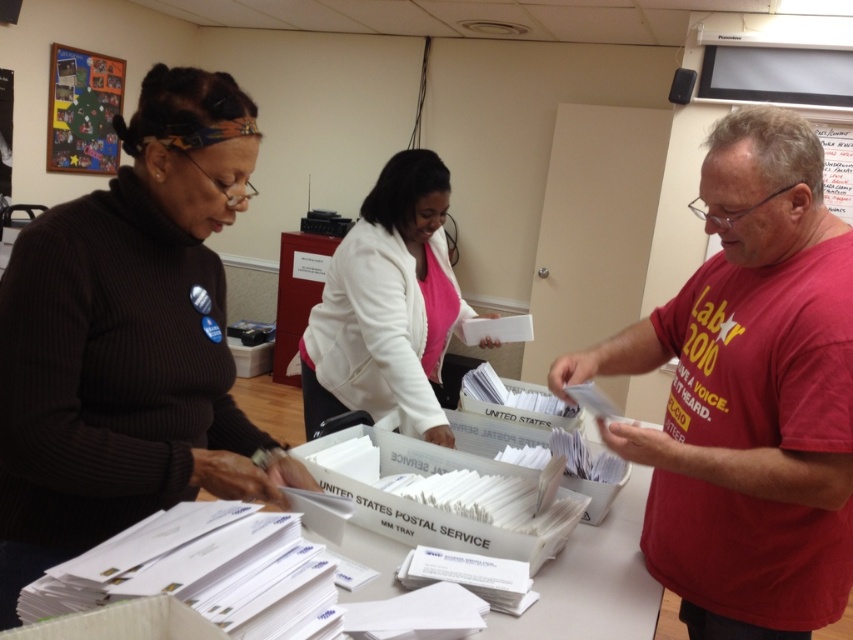
Consider the image. You are a postal worker who needs to place a new envelope into the correct tray. You notice the white matte jacket at center and the white paper at center. Which object is closer to you as you stand at the entrance of the postal service location?

The white paper at center is closer to you than the white matte jacket at center because they are 16.44 inches apart from each other.